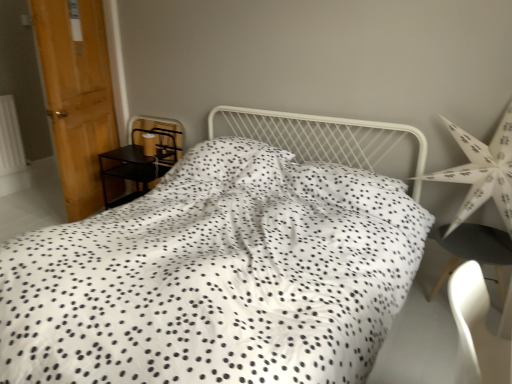
Question: Would you say white paper star at right is to the left or to the right of matte brown lampshade at left in the picture?

Choices:
 (A) right
 (B) left

Answer: (A)

Question: In terms of size, does white paper star at right appear bigger or smaller than matte brown lampshade at left?

Choices:
 (A) small
 (B) big

Answer: (B)

Question: Which object is positioned farthest from the wooden door at left?

Choices:
 (A) white dotted fabric bed at center
 (B) white paper star at right
 (C) matte brown lampshade at left
 (D) black matte chair at lower right
 (E) black metal nightstand at left

Answer: (D)

Question: Based on their relative distances, which object is farther from the wooden door at left?

Choices:
 (A) white paper star at right
 (B) black matte chair at lower right
 (C) white dotted fabric bed at center
 (D) matte brown lampshade at left
 (E) black metal nightstand at left

Answer: (B)